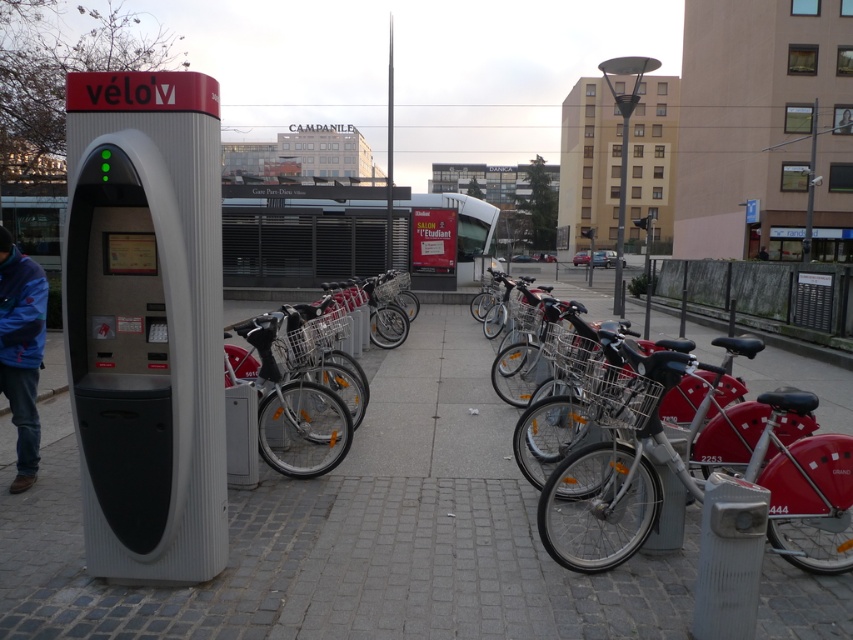
Between point (341, 419) and point (4, 388), which one is positioned behind?

Positioned behind is point (341, 419).

Who is positioned more to the left, matte red bicycle at center or blue fleece jacket at lower left?

Positioned to the left is blue fleece jacket at lower left.

Is point (346, 440) behind point (22, 480)?

Yes, point (346, 440) is farther from viewer.

Locate an element on the screen. The height and width of the screenshot is (640, 853). matte red bicycle at center is located at coordinates (291, 408).

Is gray cobblestone pavement at center shorter than blue fleece jacket at lower left?

Indeed, gray cobblestone pavement at center has a lesser height compared to blue fleece jacket at lower left.

Describe the element at coordinates (352, 532) in the screenshot. I see `gray cobblestone pavement at center` at that location.

This screenshot has width=853, height=640. Identify the location of gray cobblestone pavement at center. (352, 532).

Does metallic silver bicycle at center have a greater height compared to matte red bicycle at center?

Correct, metallic silver bicycle at center is much taller as matte red bicycle at center.

Does point (817, 508) come closer to viewer compared to point (299, 413)?

Yes, it is in front of point (299, 413).

Find the location of a particular element. metallic silver bicycle at center is located at coordinates click(618, 480).